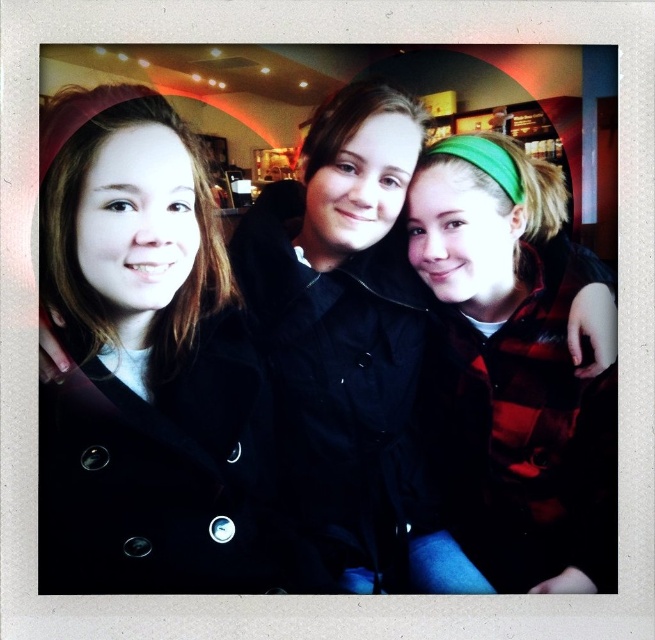
You are trying to decide which of the two people to approach for a group photo. You see the matte black coat at left and the green plaid shirt at center. Which person is closer to you based on their clothing size?

The matte black coat at left is smaller than the green plaid shirt at center, so the person wearing the matte black coat at left is closer to you since smaller objects appear closer in the image.

You are standing in the room and want to hand a gift to the person wearing the matte black coat at left and the green plaid shirt at center. Which one can you reach first without moving closer?

The matte black coat at left is closer to the viewer than the green plaid shirt at center, so you can reach the person wearing the matte black coat at left first without moving closer.

You are standing in a casual social setting like a cafe or restaurant. You see the matte black coat at left. Can you reach into your pocket to grab your keys without moving your body?

The distance between you and the matte black coat at left is 30.13 inches. Since this distance is greater than typical arm length, you cannot reach into the pocket of the matte black coat at left without moving closer or extending your body.